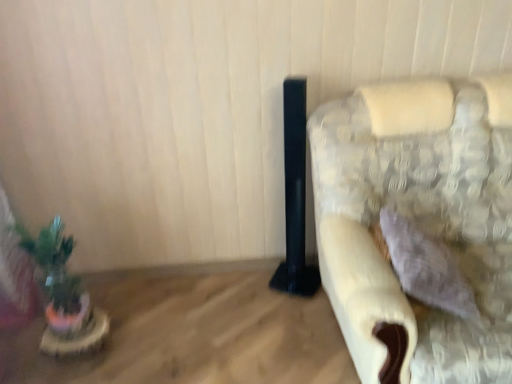
This screenshot has height=384, width=512. Identify the location of vacant space underneath green matte plant at left (from a real-world perspective). (82, 331).